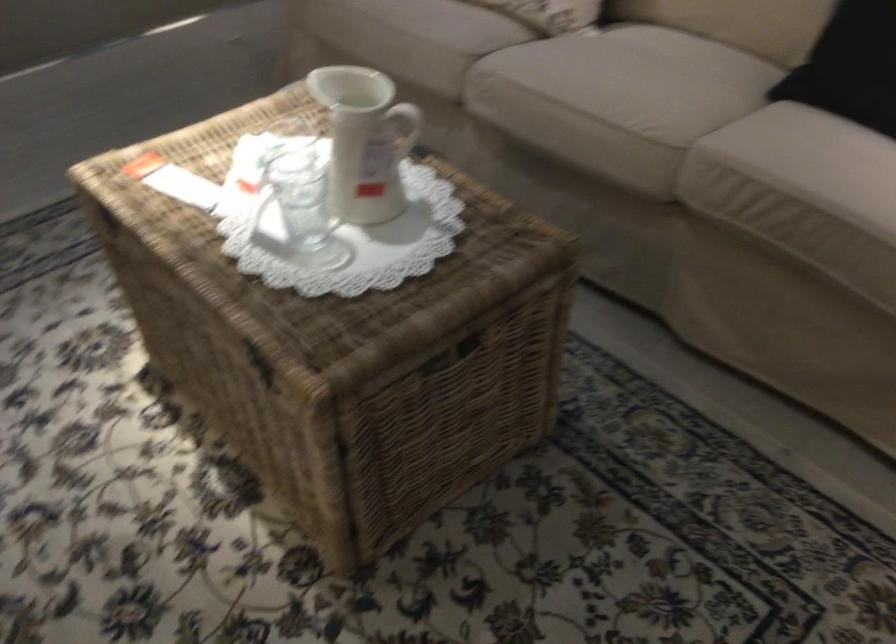
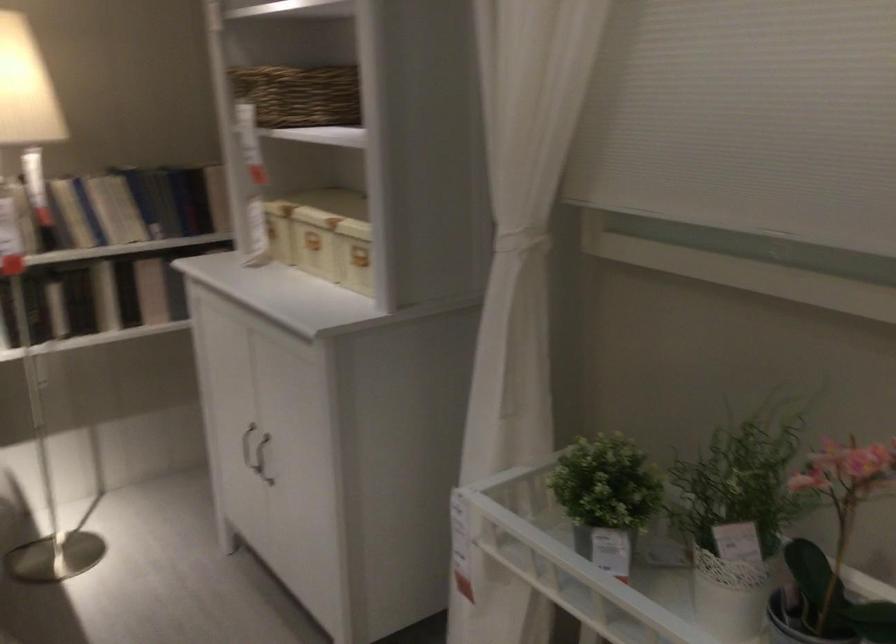
Question: The images are taken continuously from a first-person perspective. In which direction is your viewpoint rotating?

Choices:
 (A) Left
 (B) Right
 (C) Up
 (D) Down

Answer: (B)